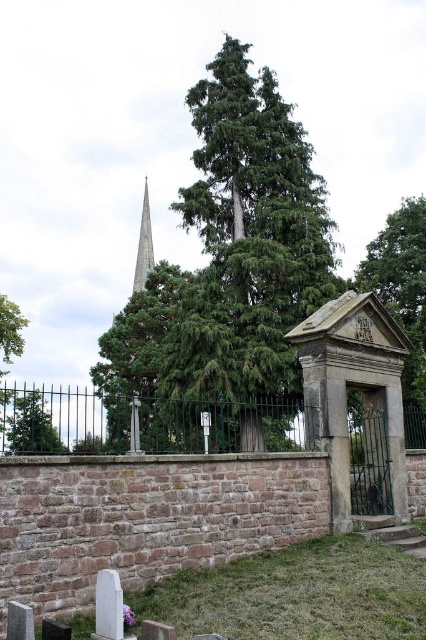
Between green coniferous tree at center and green leafy tree at right, which one is positioned lower?

green coniferous tree at center

Can you confirm if green coniferous tree at center is shorter than green leafy tree at right?

No.

Is point (278, 324) closer to viewer compared to point (402, 266)?

Yes, it is in front of point (402, 266).

Where is `green coniferous tree at center`? green coniferous tree at center is located at coordinates (227, 280).

Between green wrought iron fence at center and smooth gray spire at center, which one has less height?

With less height is green wrought iron fence at center.

Can you confirm if green wrought iron fence at center is smaller than smooth gray spire at center?

Actually, green wrought iron fence at center might be larger than smooth gray spire at center.

Who is more distant from viewer, (126, 403) or (135, 266)?

The point (135, 266) is more distant.

Locate an element on the screen. The width and height of the screenshot is (426, 640). green wrought iron fence at center is located at coordinates (141, 422).

Is green leafy tree at right taller than smooth gray spire at center?

Correct, green leafy tree at right is much taller as smooth gray spire at center.

Looking at this image, is green leafy tree at right below smooth gray spire at center?

Incorrect, green leafy tree at right is not positioned below smooth gray spire at center.

I want to click on green leafy tree at right, so click(402, 300).